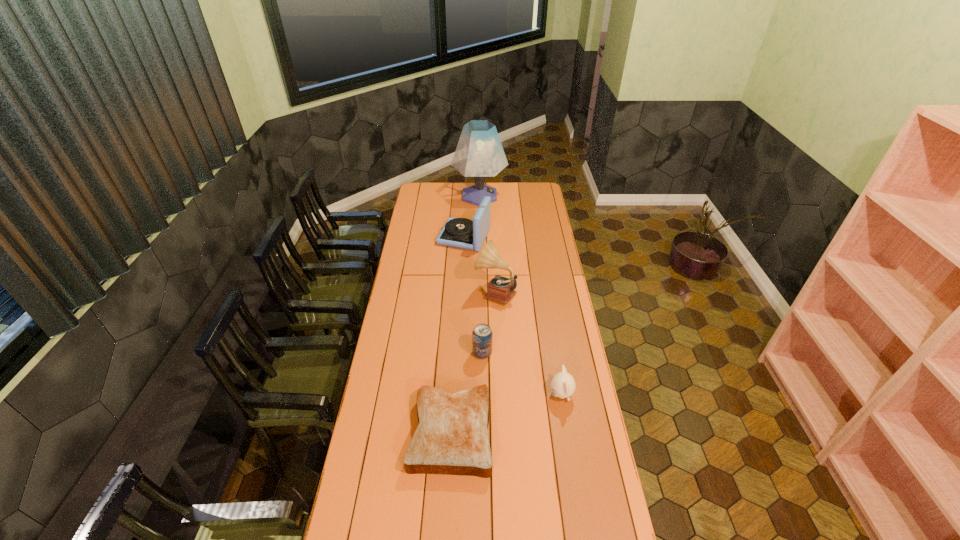
Where is `lampshade`? Image resolution: width=960 pixels, height=540 pixels. lampshade is located at coordinates (479, 153).

This screenshot has height=540, width=960. Identify the location of the farthest object. (479, 153).

Where is `the second tallest object`? The image size is (960, 540). the second tallest object is located at coordinates (500, 289).

Where is `the taller phonograph record`? The height and width of the screenshot is (540, 960). the taller phonograph record is located at coordinates (500, 289).

Locate an element on the screen. This screenshot has height=540, width=960. the farther phonograph record is located at coordinates (462, 233).

The width and height of the screenshot is (960, 540). Identify the location of the shorter phonograph record. (462, 233).

The width and height of the screenshot is (960, 540). I want to click on pop soda, so click(482, 335).

Where is `kitten`? The height and width of the screenshot is (540, 960). kitten is located at coordinates (563, 385).

Where is `the rightmost object`? This screenshot has height=540, width=960. the rightmost object is located at coordinates (563, 385).

The width and height of the screenshot is (960, 540). I want to click on the shortest object, so click(451, 438).